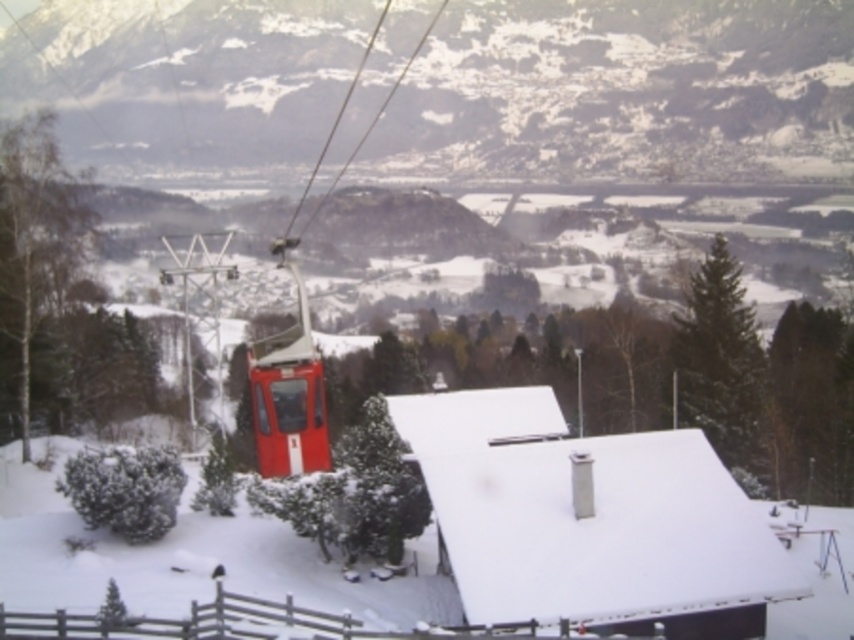
Is white matte roof at center shorter than brown wooden fence at lower center?

No.

Is point (457, 586) closer to viewer compared to point (3, 618)?

No, (457, 586) is further to viewer.

Who is more distant from viewer, (570, 444) or (220, 636)?

Positioned behind is point (570, 444).

This screenshot has height=640, width=854. What are the coordinates of `white matte roof at center` in the screenshot? It's located at (607, 536).